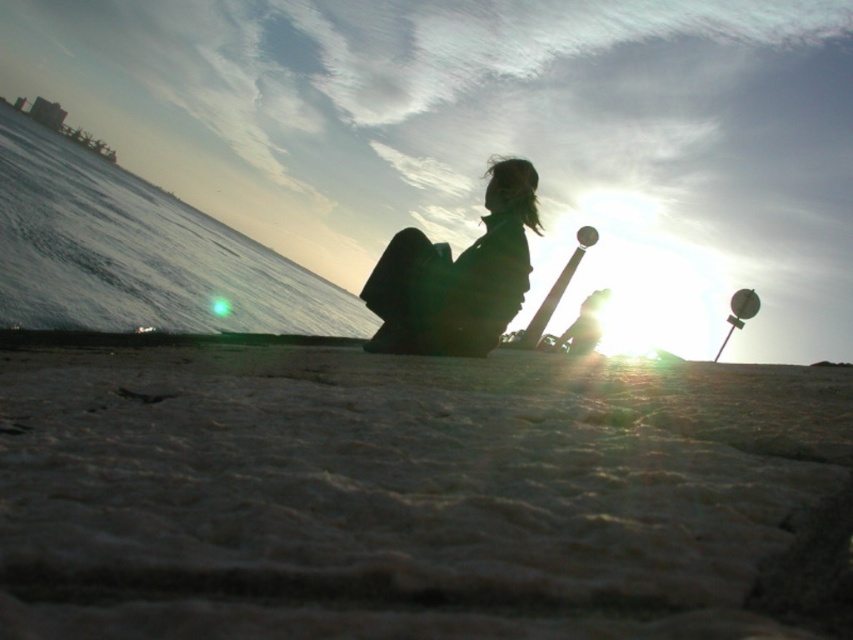
You are standing at the origin point of the coordinate system. Looking at the sandy textured ground at lower center, can you tell me its coordinates?

The sandy textured ground at lower center is located at coordinates point (415, 493).